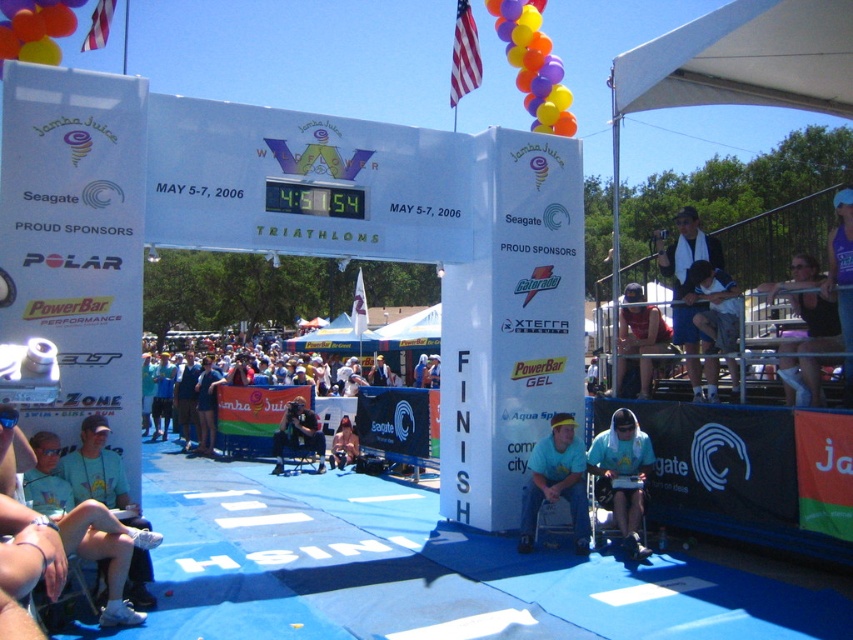
You are a photographer standing at the finish line of the triathlon event. You want to capture both the point at coordinates point (830, 324) and point (640, 480) in your photo. Which point is closer to the camera so that it appears larger in the photo?

Point (830, 324) is closer to the camera than point (640, 480), so it will appear larger in the photo.